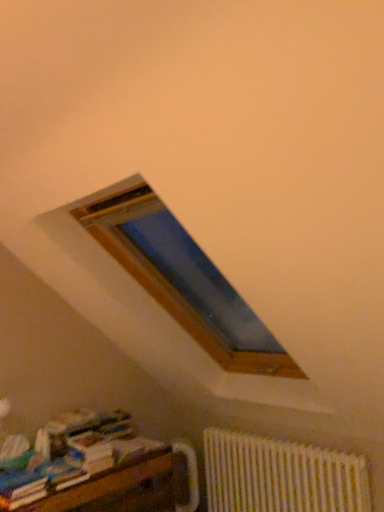
Question: From the image's perspective, is white textured radiator at lower right over wooden bookshelf at lower left?

Choices:
 (A) no
 (B) yes

Answer: (A)

Question: Is white textured radiator at lower right facing away from wooden bookshelf at lower left?

Choices:
 (A) no
 (B) yes

Answer: (A)

Question: Is white textured radiator at lower right not inside wooden bookshelf at lower left?

Choices:
 (A) yes
 (B) no

Answer: (A)

Question: Considering the relative sizes of white textured radiator at lower right and wooden bookshelf at lower left in the image provided, is white textured radiator at lower right wider than wooden bookshelf at lower left?

Choices:
 (A) yes
 (B) no

Answer: (B)

Question: Is the surface of white textured radiator at lower right in direct contact with wooden bookshelf at lower left?

Choices:
 (A) no
 (B) yes

Answer: (A)

Question: Is white textured radiator at lower right inside or outside of wooden bookshelf at lower left?

Choices:
 (A) outside
 (B) inside

Answer: (A)

Question: Is white textured radiator at lower right in front of or behind wooden bookshelf at lower left in the image?

Choices:
 (A) front
 (B) behind

Answer: (B)

Question: Would you say white textured radiator at lower right is to the left or to the right of wooden bookshelf at lower left in the picture?

Choices:
 (A) right
 (B) left

Answer: (A)

Question: Is white textured radiator at lower right bigger or smaller than wooden bookshelf at lower left?

Choices:
 (A) small
 (B) big

Answer: (A)

Question: From a real-world perspective, is wooden bookshelf at lower left positioned above or below multicolored paper at lower left?

Choices:
 (A) above
 (B) below

Answer: (B)

Question: Looking at their shapes, would you say wooden bookshelf at lower left is wider or thinner than multicolored paper at lower left?

Choices:
 (A) thin
 (B) wide

Answer: (B)

Question: Is point click(x=99, y=494) closer or farther from the camera than point click(x=26, y=488)?

Choices:
 (A) farther
 (B) closer

Answer: (A)

Question: Is wooden bookshelf at lower left in front of or behind multicolored paper at lower left in the image?

Choices:
 (A) front
 (B) behind

Answer: (A)

Question: Is multicolored paper at lower left in front of or behind white textured radiator at lower right in the image?

Choices:
 (A) front
 (B) behind

Answer: (A)

Question: In terms of height, does multicolored paper at lower left look taller or shorter compared to white textured radiator at lower right?

Choices:
 (A) short
 (B) tall

Answer: (A)